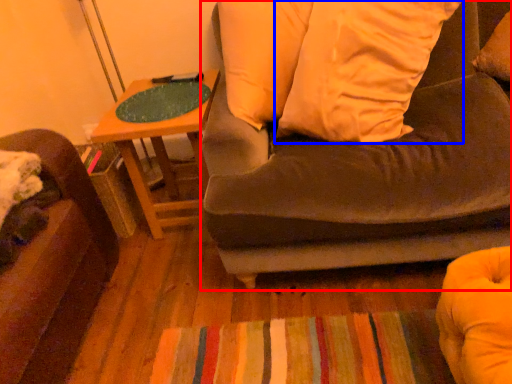
Question: Which point is further to the camera, studio couch (highlighted by a red box) or pillow (highlighted by a blue box)?

Choices:
 (A) studio couch
 (B) pillow

Answer: (B)